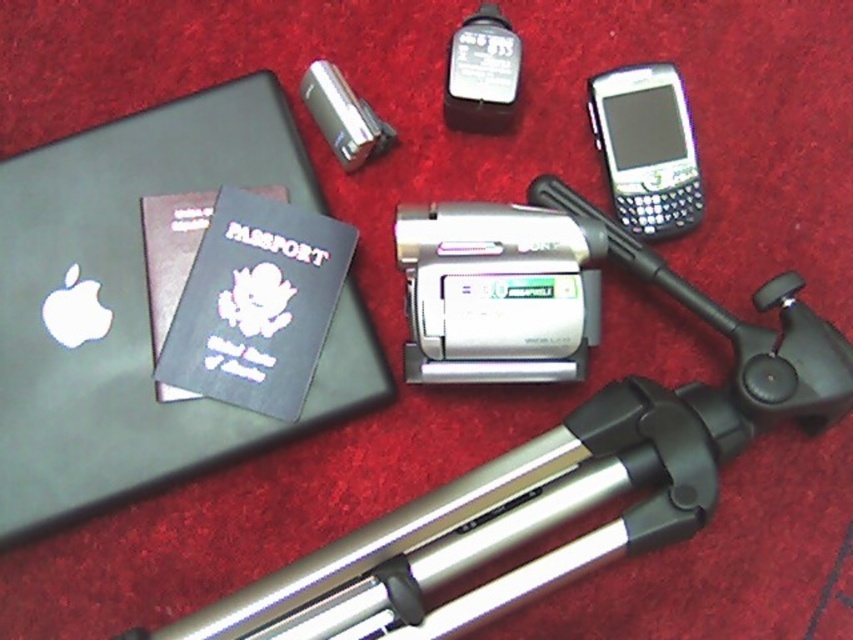
Question: Can you confirm if silver metallic tripod at lower center is positioned to the right of blue matte passport at center-left?

Choices:
 (A) yes
 (B) no

Answer: (A)

Question: Which point is farther to the camera?

Choices:
 (A) (432, 502)
 (B) (674, 212)
 (C) (244, 432)
 (D) (234, 196)

Answer: (D)

Question: Does matte black laptop at upper left appear under silver metallic tripod at lower center?

Choices:
 (A) yes
 (B) no

Answer: (B)

Question: Does silver metallic tripod at lower center appear on the right side of black glossy smartphone at upper right?

Choices:
 (A) yes
 (B) no

Answer: (B)

Question: Which object appears farthest from the camera in this image?

Choices:
 (A) matte black laptop at upper left
 (B) black glossy smartphone at upper right
 (C) silver metallic video camera at center

Answer: (B)

Question: Which of the following is the closest to the observer?

Choices:
 (A) (148, 442)
 (B) (763, 401)
 (C) (548, 269)

Answer: (B)